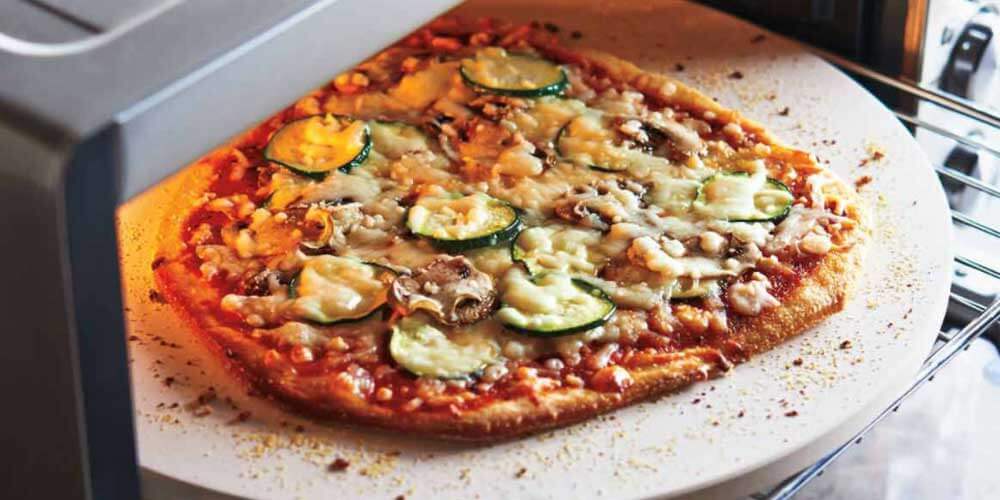
Locate an element on the screen. The image size is (1000, 500). rack for oven is located at coordinates tap(965, 340).